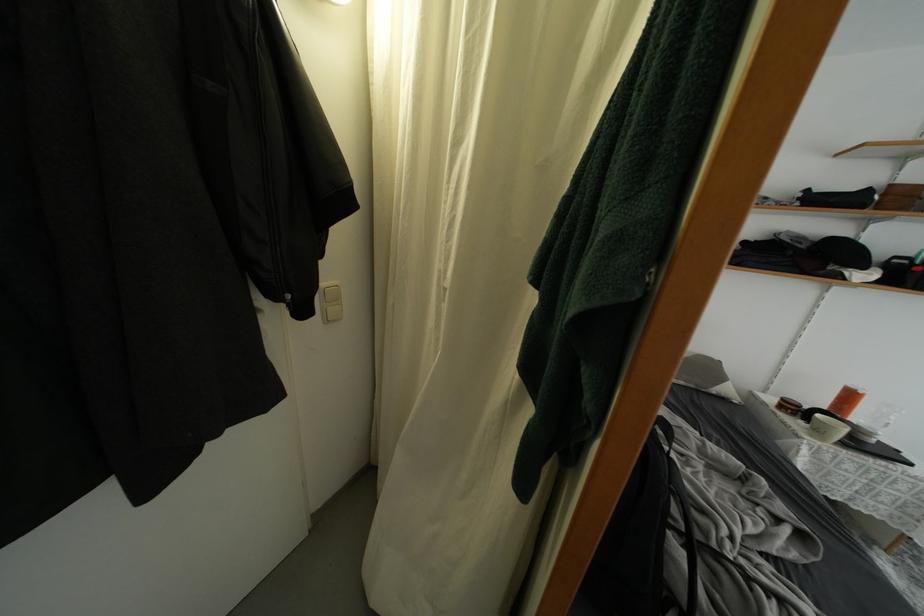
Find the location of a particular element. black cap is located at coordinates (842, 252).